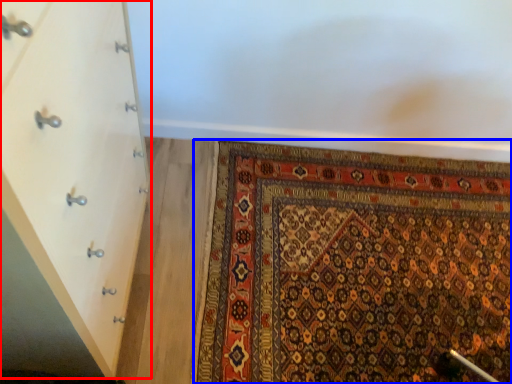
Question: Which object appears farthest to the camera in this image, chest of drawers (highlighted by a red box) or mat (highlighted by a blue box)?

Choices:
 (A) chest of drawers
 (B) mat

Answer: (B)